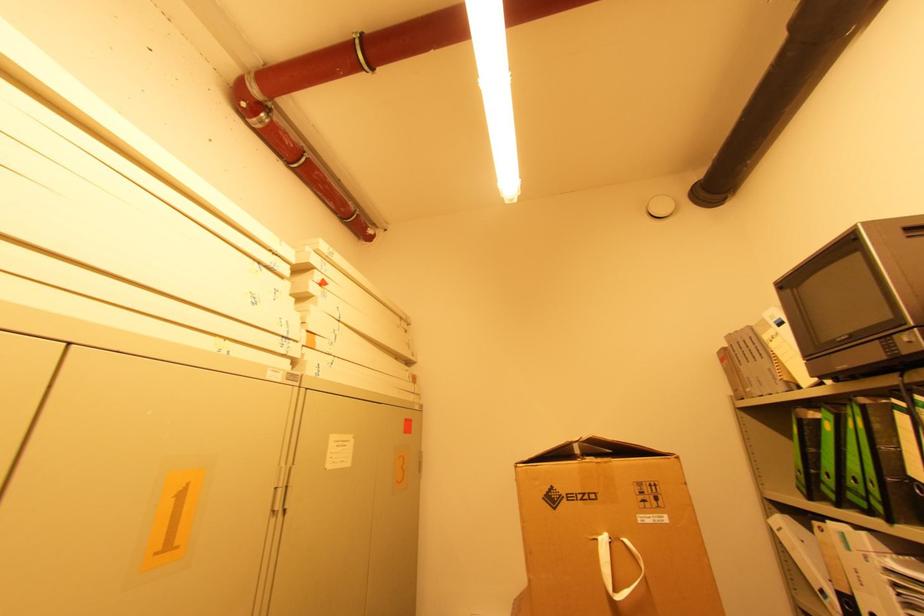
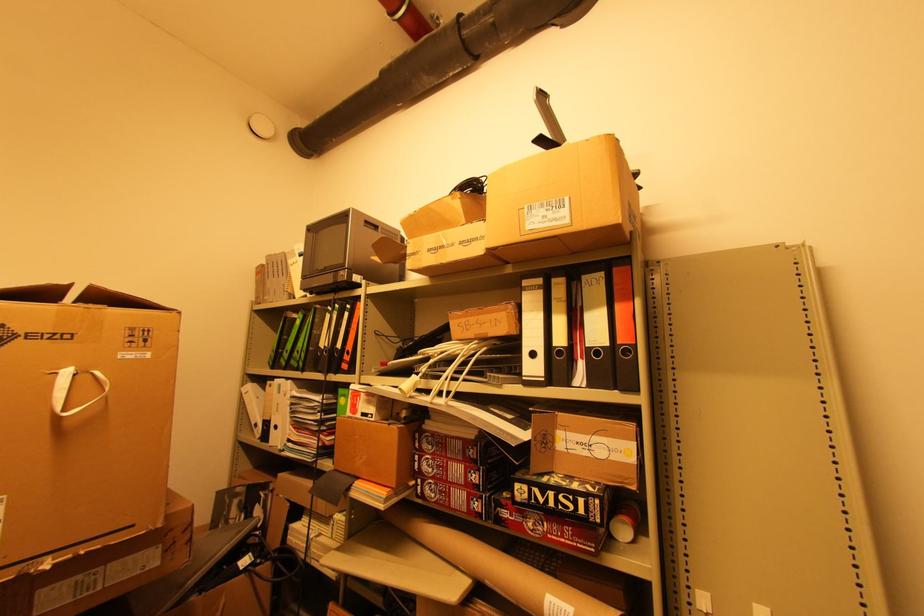
Question: The camera is either moving clockwise (left) or counter-clockwise (right) around the object. The first image is from the beginning of the video and the second image is from the end. Is the camera moving left or right when shooting the video?

Choices:
 (A) Left
 (B) Right

Answer: (A)